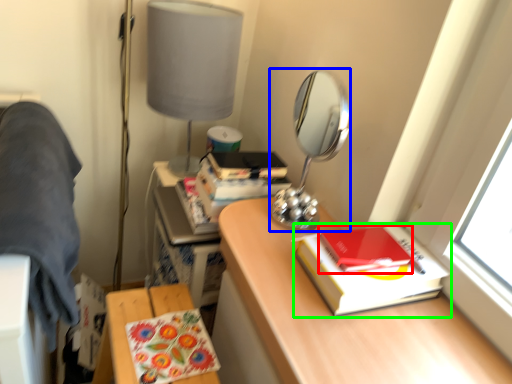
Question: Which object is positioned farthest from notebook (highlighted by a red box)? Select from mirror (highlighted by a blue box) and paperback book (highlighted by a green box).

Choices:
 (A) mirror
 (B) paperback book

Answer: (A)